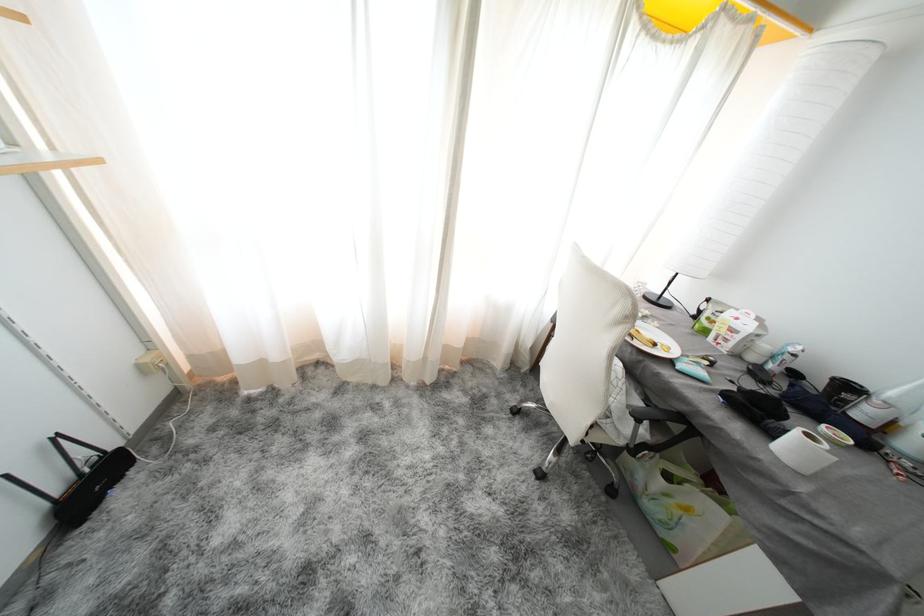
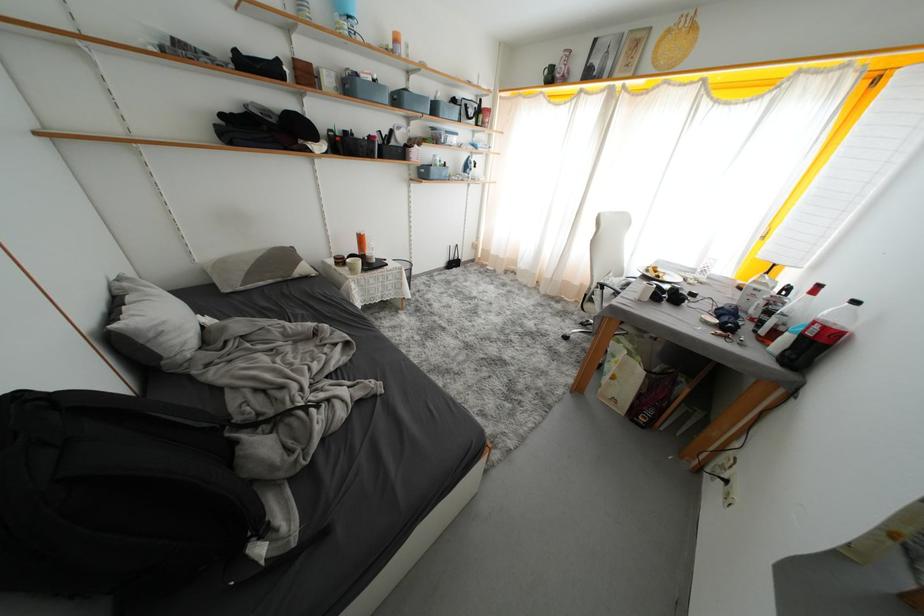
Locate, in the second image, the point that corresponds to pixel 599 431 in the first image.

(591, 299)